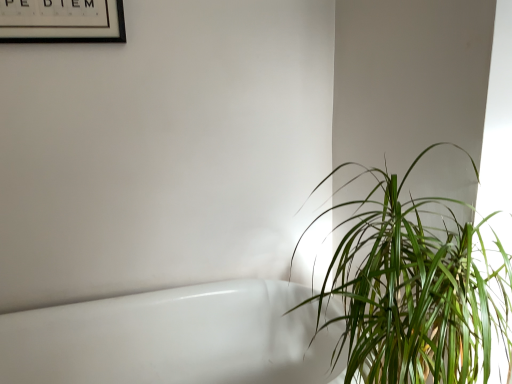
Question: Is green leafy plant at right positioned far away from black matte picture frame at upper left?

Choices:
 (A) no
 (B) yes

Answer: (B)

Question: From the image's perspective, does green leafy plant at right appear lower than black matte picture frame at upper left?

Choices:
 (A) no
 (B) yes

Answer: (B)

Question: Does green leafy plant at right have a smaller size compared to black matte picture frame at upper left?

Choices:
 (A) yes
 (B) no

Answer: (B)

Question: Does green leafy plant at right touch black matte picture frame at upper left?

Choices:
 (A) yes
 (B) no

Answer: (B)

Question: From a real-world perspective, is green leafy plant at right below black matte picture frame at upper left?

Choices:
 (A) no
 (B) yes

Answer: (B)

Question: Looking at the image, does green leafy plant at right seem bigger or smaller compared to white glossy bathtub at lower left?

Choices:
 (A) big
 (B) small

Answer: (B)

Question: From the image's perspective, is green leafy plant at right above or below white glossy bathtub at lower left?

Choices:
 (A) above
 (B) below

Answer: (A)

Question: Is point (373, 172) positioned closer to the camera than point (77, 334)?

Choices:
 (A) closer
 (B) farther

Answer: (B)

Question: In the image, is green leafy plant at right on the left side or the right side of white glossy bathtub at lower left?

Choices:
 (A) left
 (B) right

Answer: (B)

Question: Is green leafy plant at right in front of or behind black matte picture frame at upper left in the image?

Choices:
 (A) front
 (B) behind

Answer: (A)

Question: From a real-world perspective, is green leafy plant at right positioned above or below black matte picture frame at upper left?

Choices:
 (A) above
 (B) below

Answer: (B)

Question: Based on their sizes in the image, would you say green leafy plant at right is bigger or smaller than black matte picture frame at upper left?

Choices:
 (A) small
 (B) big

Answer: (B)

Question: In terms of width, does green leafy plant at right look wider or thinner when compared to black matte picture frame at upper left?

Choices:
 (A) wide
 (B) thin

Answer: (A)

Question: From the image's perspective, relative to black matte picture frame at upper left, is white glossy bathtub at lower left above or below?

Choices:
 (A) below
 (B) above

Answer: (A)

Question: Would you say white glossy bathtub at lower left is inside or outside black matte picture frame at upper left?

Choices:
 (A) outside
 (B) inside

Answer: (A)